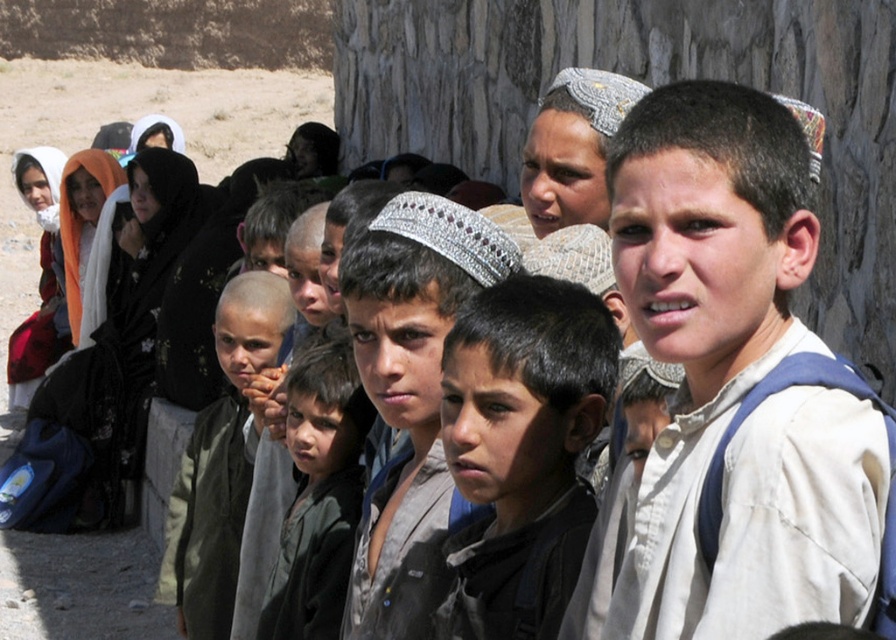
Question: Is dark green jacket at center to the right of silver textured headband at center from the viewer's perspective?

Choices:
 (A) yes
 (B) no

Answer: (B)

Question: Which object is the farthest from the dark green jacket at center?

Choices:
 (A) dark brown hair at center
 (B) silver textured headband at center
 (C) shiny silver headband at center

Answer: (A)

Question: Is dark brown hair at center in front of silver textured headband at center?

Choices:
 (A) yes
 (B) no

Answer: (A)

Question: Which object is farther from the camera taking this photo?

Choices:
 (A) dark green fabric at center
 (B) shiny silver headband at center
 (C) silver textured headband at center

Answer: (C)

Question: Does dark green fabric at center appear on the right side of silver textured headband at center?

Choices:
 (A) yes
 (B) no

Answer: (B)

Question: Among these points, which one is farthest from the camera?

Choices:
 (A) (244, 278)
 (B) (423, 337)
 (C) (565, 180)

Answer: (A)